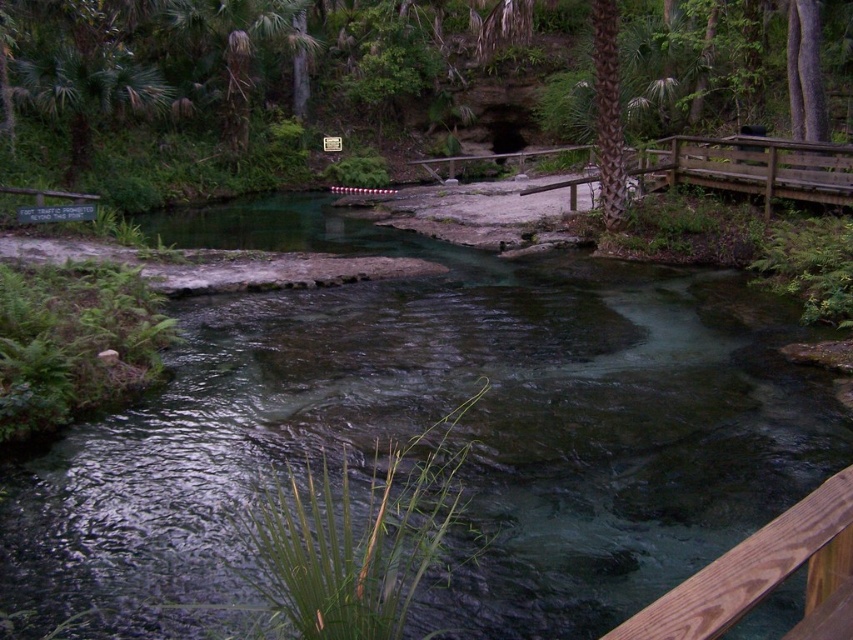
Consider the image. You are a hiker who wants to cross the stream using the wooden bridge. However, you notice the brown textured palm tree at upper center and the clear water stream at center. Which object is closer to the bridge?

The clear water stream at center is positioned under the brown textured palm tree at upper center, so the stream is closer to the bridge than the palm tree.

You are a hiker standing at the wooden bridge and want to take a photo of the brown wood rail at lower right and the brown textured palm tree at upper center. Which object will appear larger in your photo?

The brown wood rail at lower right will appear larger in the photo because it is closer to the viewer than the brown textured palm tree at upper center.

You are planning to cross the stream using the wooden bridge. Considering the size of the clear water stream at center and the brown wood rail at lower right, which one is wider?

The clear water stream at center is wider than the brown wood rail at lower right because the stream has a larger size compared to the rail.